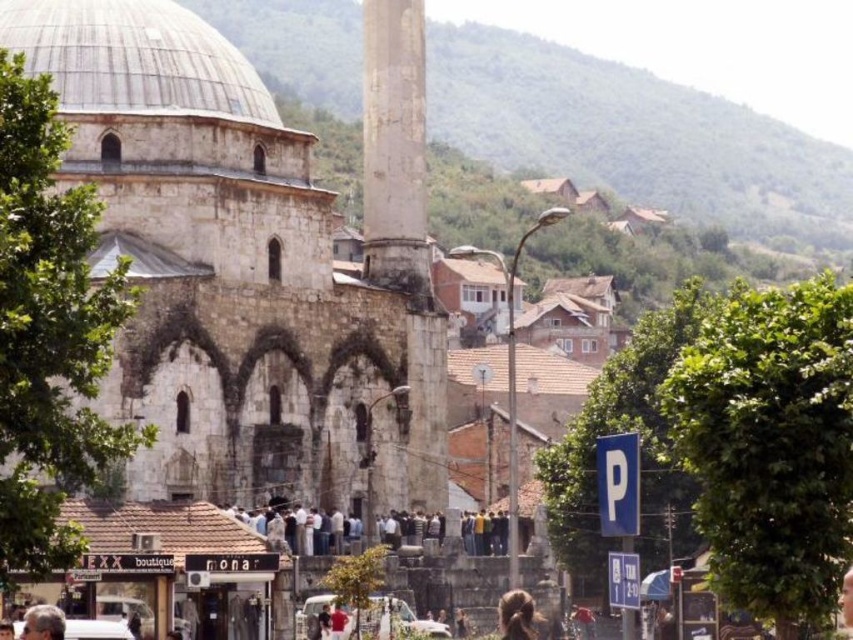
You are a tourist standing in front of the mosque and want to take a photo that includes both the gray stone dome at upper center and the dark gray stone people at center. Which object should you focus on first to ensure both are in frame?

You should focus on the dark gray stone people at center first because the gray stone dome at upper center is positioned over them, meaning the dome is above the people and likely already in the frame if the people are centered.

You are a photographer trying to capture a photo of the gray stone minaret at center and the brown fuzzy hair at lower center. Which object should you focus on first if you want to ensure both are in sharp focus?

The gray stone minaret at center is taller than brown fuzzy hair at lower center, so you should focus on the gray stone minaret at center first to ensure both are in sharp focus.

Based on the photo, you are a photographer standing at the back of the crowd. You want to capture a photo of the gray stone minaret at center and the dark gray stone people at center in the same frame. Based on their sizes, will the minaret appear taller than the people in the photo?

The gray stone minaret at center is taller than the dark gray stone people at center, so in the photo, the minaret will appear taller than the people.